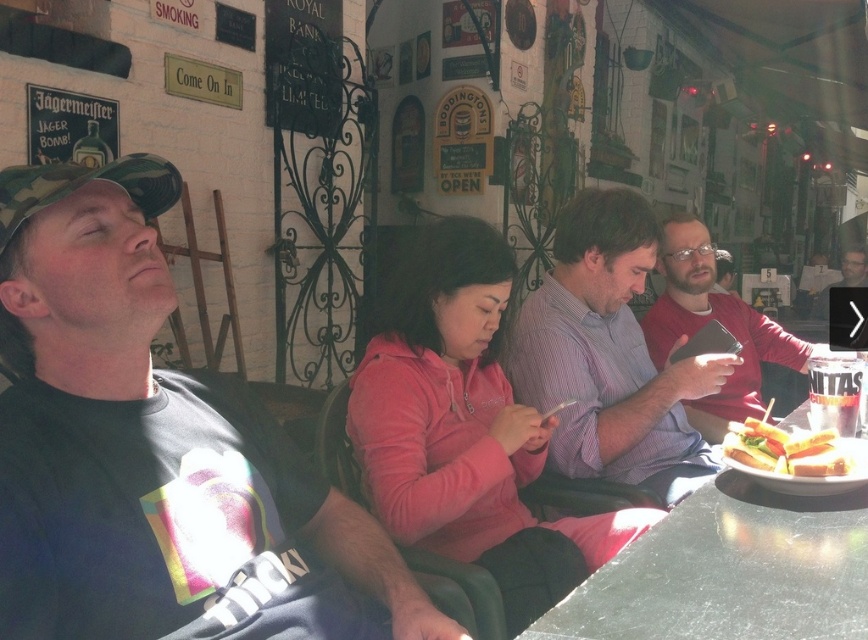
Question: Does green marble table at center come behind white bread sandwich at lower right?

Choices:
 (A) no
 (B) yes

Answer: (A)

Question: Is dark blue t-shirt at left to the left of pink fleece jacket at center from the viewer's perspective?

Choices:
 (A) no
 (B) yes

Answer: (B)

Question: Which point is closer to the camera taking this photo?

Choices:
 (A) (786, 456)
 (B) (431, 464)
 (C) (740, 356)

Answer: (A)

Question: Observing the image, what is the correct spatial positioning of dark blue t-shirt at left in reference to light blue striped shirt at center?

Choices:
 (A) below
 (B) above

Answer: (A)

Question: Which point is farther to the camera?

Choices:
 (A) light blue striped shirt at center
 (B) dark blue t-shirt at left
 (C) pink fleece jacket at center

Answer: (A)

Question: Which is farther from the pink fleece jacket at center?

Choices:
 (A) dark blue t-shirt at left
 (B) matte red shirt at center
 (C) green marble table at center

Answer: (B)